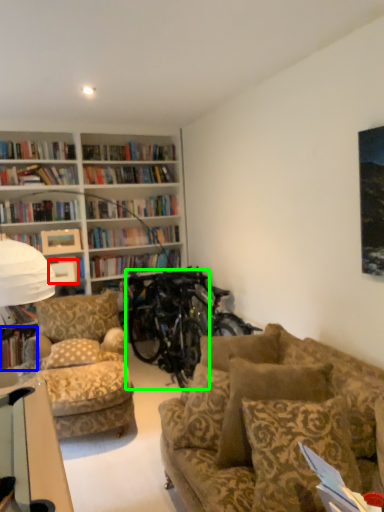
Question: Considering the real-world distances, which object is farthest from picture frame (highlighted by a red box)? book (highlighted by a blue box) or bicycle (highlighted by a green box)?

Choices:
 (A) book
 (B) bicycle

Answer: (B)